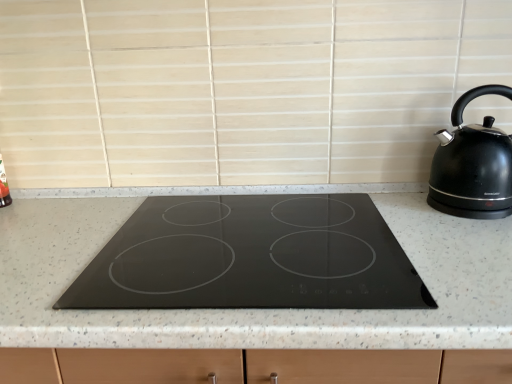
The height and width of the screenshot is (384, 512). In order to click on free location to the left of black glossy kettle at right in this screenshot , I will do `click(399, 213)`.